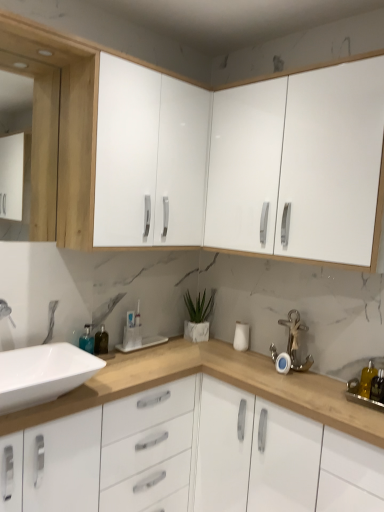
You are a GUI agent. You are given a task and a screenshot of the screen. Output one action in this format:
    pyautogui.click(x=<x>, y=<y>)
    Task: Click on the free space in front of silver metallic anchor at lower right
    Image resolution: width=384 pixels, height=512 pixels.
    Given the screenshot: What is the action you would take?
    pyautogui.click(x=316, y=377)